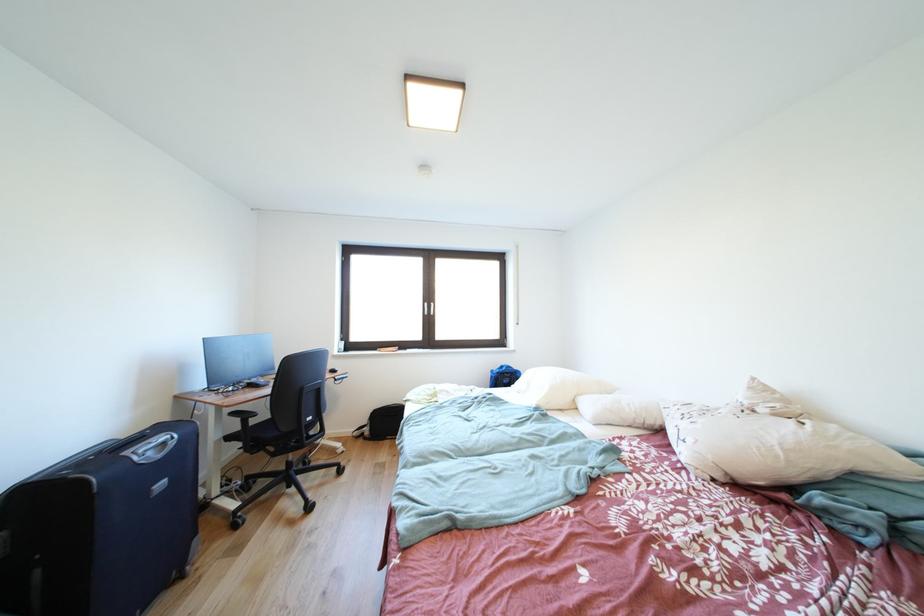
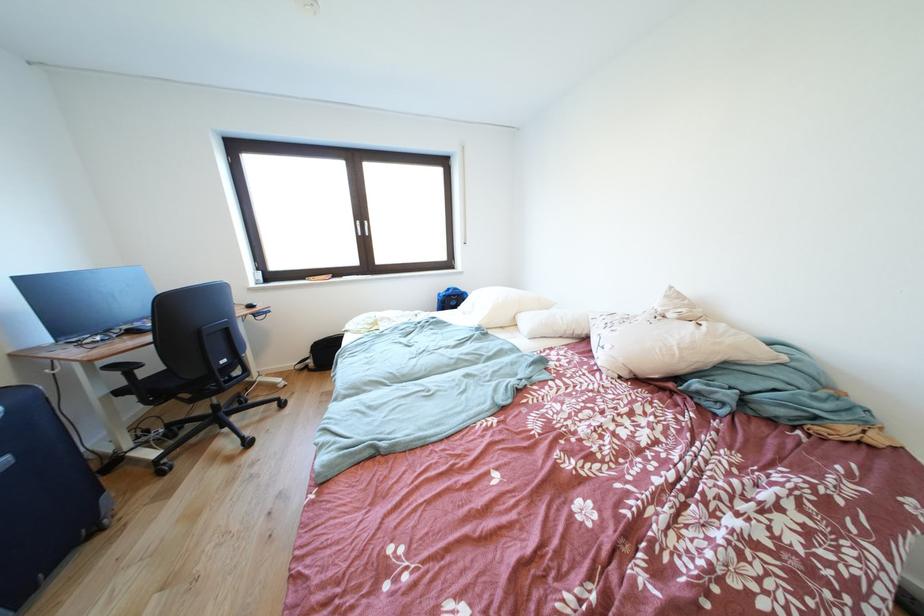
Where in the second image is the point corresponding to (x=500, y=376) from the first image?

(447, 299)